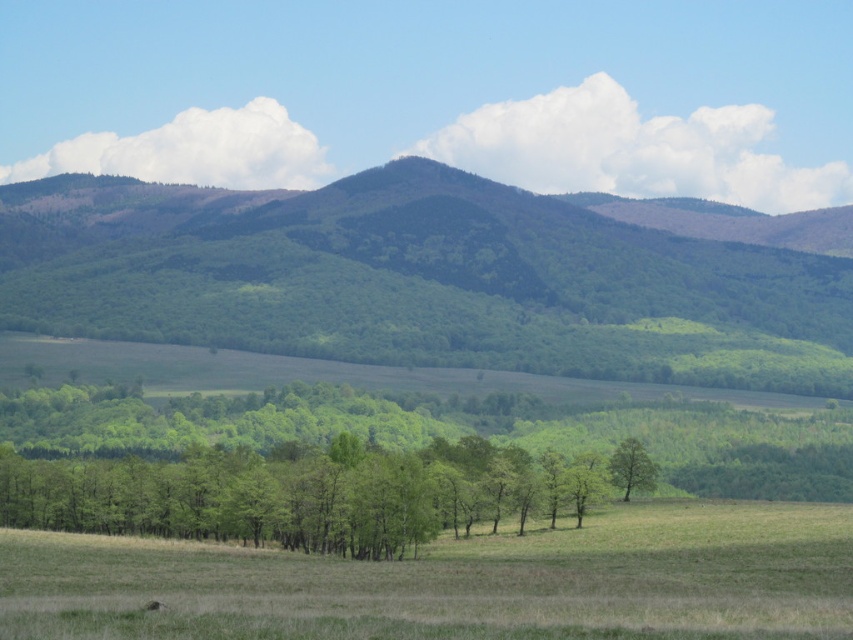
Which of these two, green forested hill at center or green matte tree at center, stands shorter?

Standing shorter between the two is green matte tree at center.

Does green forested hill at center have a lesser width compared to green matte tree at center?

Incorrect, green forested hill at center's width is not less than green matte tree at center's.

Identify the location of green forested hill at center. The image size is (853, 640). (419, 280).

Find the location of a particular element. green forested hill at center is located at coordinates (419, 280).